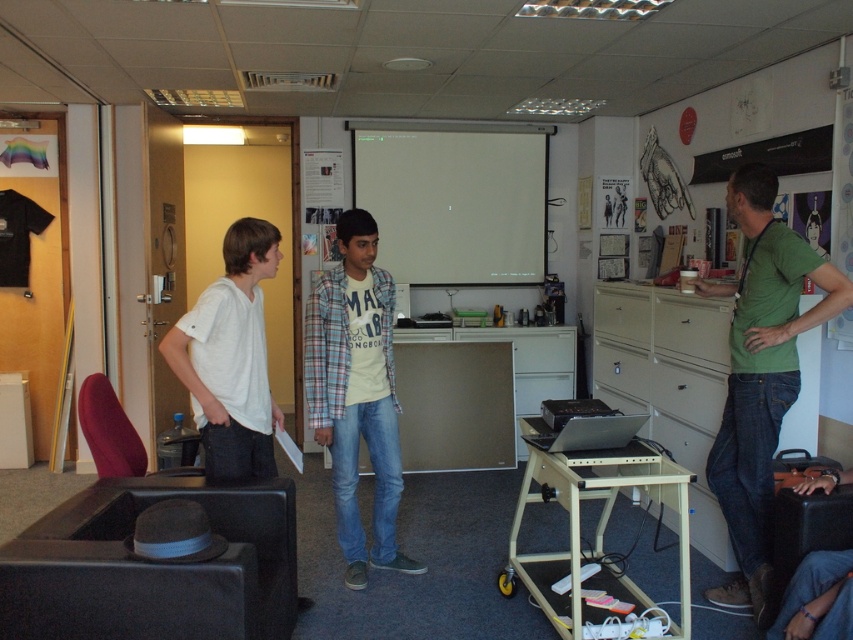
Question: Which point appears closest to the camera in this image?

Choices:
 (A) (323, 305)
 (B) (782, 268)

Answer: (B)

Question: Does green cotton shirt at right have a larger size compared to white matte shirt at left?

Choices:
 (A) yes
 (B) no

Answer: (A)

Question: Considering the real-world distances, which object is farthest from the plaid cotton shirt at center?

Choices:
 (A) green cotton shirt at right
 (B) white matte shirt at left

Answer: (A)

Question: Does green cotton shirt at right appear under white matte shirt at left?

Choices:
 (A) yes
 (B) no

Answer: (A)

Question: Based on their relative distances, which object is nearer to the plaid cotton shirt at center?

Choices:
 (A) green cotton shirt at right
 (B) white matte shirt at left

Answer: (B)

Question: Can you confirm if green cotton shirt at right is bigger than white matte shirt at left?

Choices:
 (A) yes
 (B) no

Answer: (A)